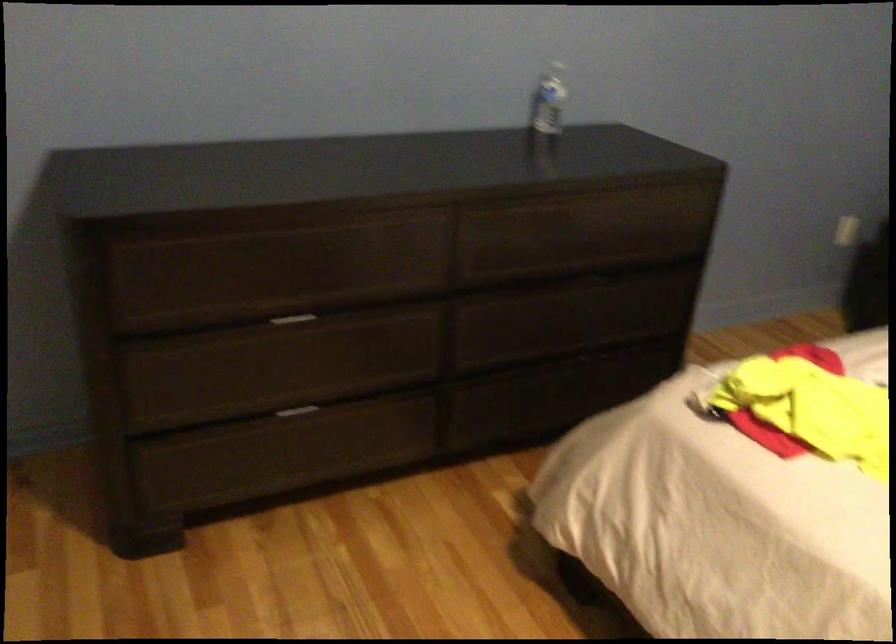
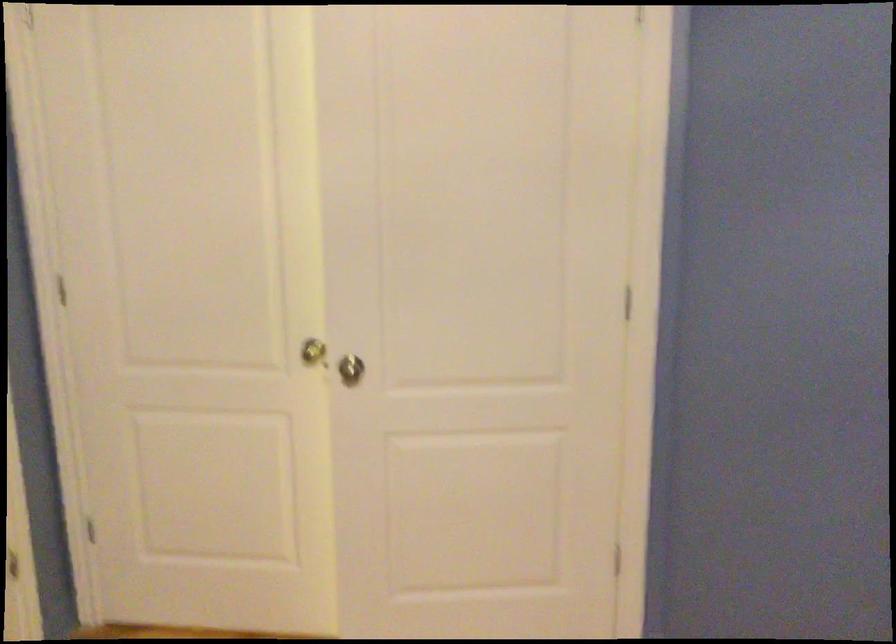
Question: The images are taken continuously from a first-person perspective. In which direction is your viewpoint rotating?

Choices:
 (A) Left
 (B) Right
 (C) Up
 (D) Down

Answer: (A)